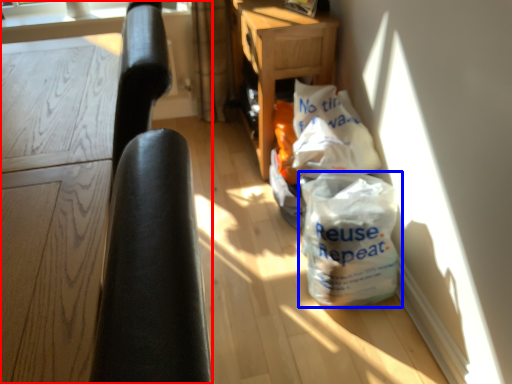
Question: Which point is further to the camera, furniture (highlighted by a red box) or plastic bag (highlighted by a blue box)?

Choices:
 (A) furniture
 (B) plastic bag

Answer: (B)